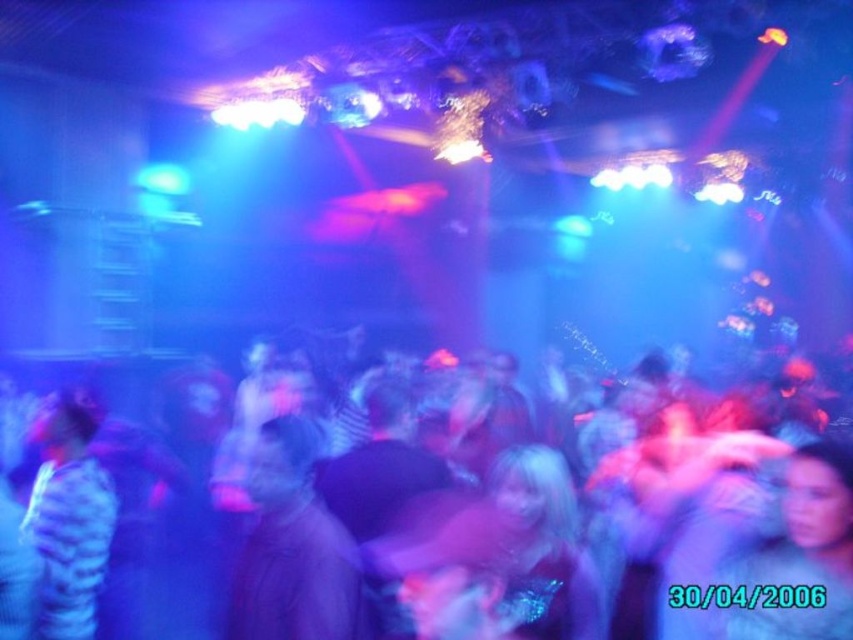
Question: Is blurred people at center thinner than striped fabric shirt at left?

Choices:
 (A) no
 (B) yes

Answer: (B)

Question: Which object is farther from the camera taking this photo?

Choices:
 (A) striped fabric shirt at left
 (B) blurred people at center

Answer: (A)

Question: Where is blurred people at center located in relation to striped fabric shirt at left in the image?

Choices:
 (A) above
 (B) below

Answer: (B)

Question: Which object appears farthest from the camera in this image?

Choices:
 (A) blurred people at center
 (B) striped fabric shirt at left

Answer: (B)

Question: Is blurred people at center above striped fabric shirt at left?

Choices:
 (A) no
 (B) yes

Answer: (A)

Question: Among these objects, which one is farthest from the camera?

Choices:
 (A) blurred people at center
 (B) striped fabric shirt at left

Answer: (B)